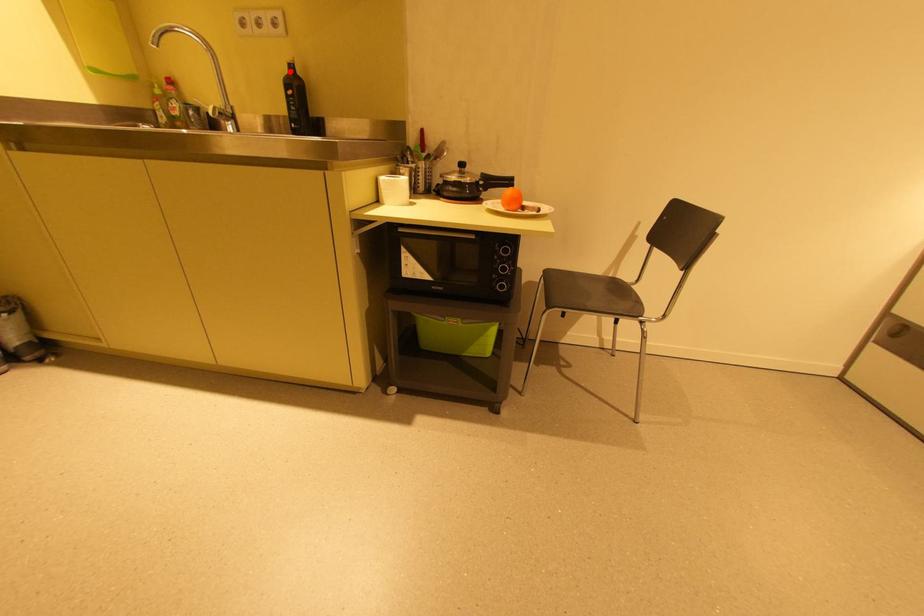
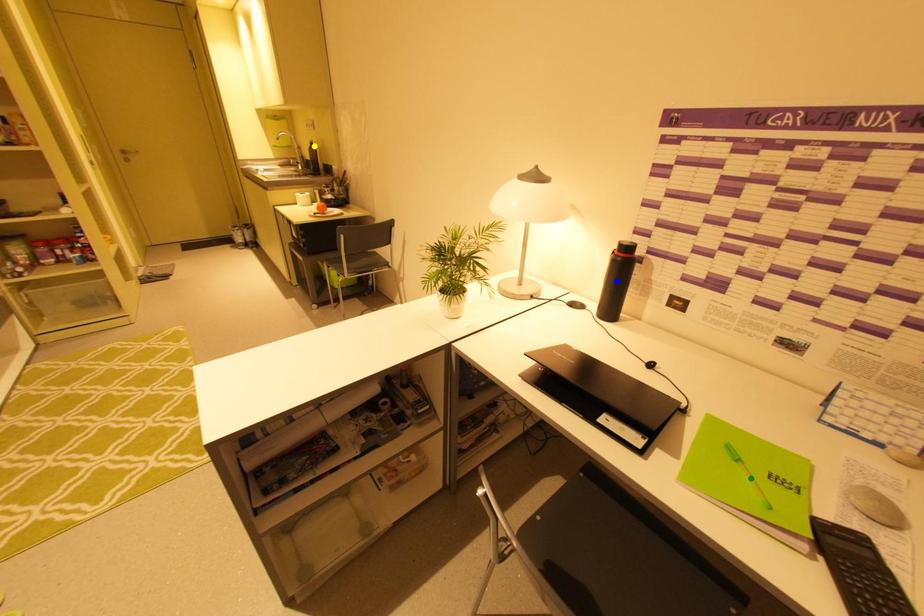
Question: I am providing you with two images of the same scene from different viewpoints. A red point is marked on the first image. You are given multiple points on the second image. Can you choose the point in image 2 that corresponds to the point in image 1?

Choices:
 (A) yellow point
 (B) green point
 (C) blue point

Answer: (A)